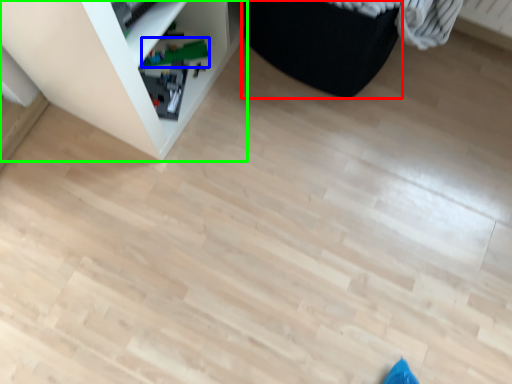
Question: Estimate the real-world distances between objects in this image. Which object is farther from furniture (highlighted by a red box), toy (highlighted by a blue box) or shelf (highlighted by a green box)?

Choices:
 (A) toy
 (B) shelf

Answer: (A)